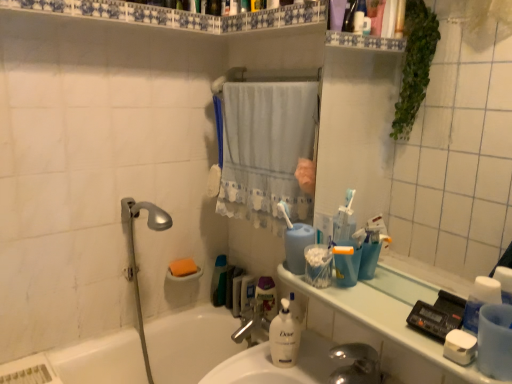
Measure the distance between white glossy bathtub at lower left and camera.

white glossy bathtub at lower left is 4.39 feet away from camera.

Describe the element at coordinates (176, 15) in the screenshot. I see `white glossy shelf at upper center` at that location.

The height and width of the screenshot is (384, 512). What do you see at coordinates (298, 246) in the screenshot?
I see `blue matte cup at center, which ranks as the 2th cleaning product in bottom-to-top order` at bounding box center [298, 246].

Image resolution: width=512 pixels, height=384 pixels. Describe the element at coordinates (426, 147) in the screenshot. I see `transparent plastic mirror at upper right` at that location.

The height and width of the screenshot is (384, 512). What are the coordinates of `white glossy bathtub at lower left` in the screenshot? It's located at (190, 343).

Which of these two, green plastic bottle at center or blue matte cup at center, which ranks as the 2th cleaning product in bottom-to-top order, stands taller?

green plastic bottle at center is taller.

What's the angular difference between green plastic bottle at center and blue matte cup at center, which ranks as the 2th cleaning product in bottom-to-top order,'s facing directions?

They differ by 90.8 degrees in their facing directions.

Is green plastic bottle at center not within blue matte cup at center, marked as the first cleaning product in a top-to-bottom arrangement?

Yes, green plastic bottle at center is located beyond the bounds of blue matte cup at center, marked as the first cleaning product in a top-to-bottom arrangement.

From the image's perspective, which one is positioned lower, green plastic bottle at center or blue matte cup at center, marked as the first cleaning product in a top-to-bottom arrangement?

green plastic bottle at center, from the image's perspective.

You are a GUI agent. You are given a task and a screenshot of the screen. Output one action in this format:
    pyautogui.click(x=<x>, y=<y>)
    Task: Click on the sink that is above the green plastic bottle at center (from a real-world perspective)
    The width and height of the screenshot is (512, 384).
    Given the screenshot: What is the action you would take?
    (x=277, y=366)

Relative to white glossy sink at center, is green plastic bottle at center in front or behind?

green plastic bottle at center is positioned farther from the viewer than white glossy sink at center.

From a real-world perspective, is green plastic bottle at center positioned above or below white glossy sink at center?

green plastic bottle at center is situated lower than white glossy sink at center in the real world.

In the scene shown: Which object is thinner, green plastic bottle at center or white glossy sink at center?

green plastic bottle at center.

Visually, is transparent plastic mirror at upper right positioned to the left or to the right of green plastic bottle at center?

transparent plastic mirror at upper right is to the right of green plastic bottle at center.

Is green plastic bottle at center at the back of transparent plastic mirror at upper right?

No, green plastic bottle at center is not at the back of transparent plastic mirror at upper right.

Considering the sizes of objects transparent plastic mirror at upper right and green plastic bottle at center in the image provided, who is thinner, transparent plastic mirror at upper right or green plastic bottle at center?

transparent plastic mirror at upper right is thinner.

Are transparent plastic mirror at upper right and green plastic bottle at center making contact?

No, transparent plastic mirror at upper right is not next to green plastic bottle at center.

Considering the relative sizes of silver metallic shower head at left and white matte soap at lower right, the 1th soap positioned from the front, in the image provided, is silver metallic shower head at left smaller than white matte soap at lower right, the 1th soap positioned from the front,?

No.

Can we say silver metallic shower head at left lies outside white matte soap at lower right, the 2th soap from the back?

That's correct, silver metallic shower head at left is outside of white matte soap at lower right, the 2th soap from the back.

Between silver metallic shower head at left and white matte soap at lower right, the first soap viewed from the right, which one has less height?

white matte soap at lower right, the first soap viewed from the right.

I want to click on counter top directly beneath the white glossy shelf at upper center (from a real-world perspective), so click(x=382, y=320).

From the image's perspective, is white glossy shelf at upper center on top of white glossy counter top at upper right?

Indeed, from the image's perspective, white glossy shelf at upper center is shown above white glossy counter top at upper right.

Is white glossy shelf at upper center bigger than white glossy counter top at upper right?

Yes, white glossy shelf at upper center is bigger than white glossy counter top at upper right.

Is white glossy shelf at upper center at the left side of white glossy counter top at upper right?

Yes, white glossy shelf at upper center is to the left of white glossy counter top at upper right.

Between white plastic toothbrush at center and blue matte cup at center, which ranks as the 2th cleaning product in bottom-to-top order, which one has larger size?

With larger size is blue matte cup at center, which ranks as the 2th cleaning product in bottom-to-top order.

Considering the points (289, 215) and (301, 229), which point is behind, point (289, 215) or point (301, 229)?

The point (289, 215) is farther from the camera.

Can you see white plastic toothbrush at center touching blue matte cup at center, which ranks as the 2th cleaning product in bottom-to-top order?

No.

In the scene shown: Is white plastic toothbrush at center facing towards blue matte cup at center, marked as the first cleaning product in a top-to-bottom arrangement?

No, white plastic toothbrush at center is not turned towards blue matte cup at center, marked as the first cleaning product in a top-to-bottom arrangement.

Is transparent plastic mirror at upper right facing away from white glossy bathtub at lower left?

No.

Is transparent plastic mirror at upper right inside or outside of white glossy bathtub at lower left?

transparent plastic mirror at upper right is outside white glossy bathtub at lower left.

Can you tell me how much transparent plastic mirror at upper right and white glossy bathtub at lower left differ in facing direction?

The angle between the facing direction of transparent plastic mirror at upper right and the facing direction of white glossy bathtub at lower left is 90.8 degrees.

Is the position of transparent plastic mirror at upper right less distant than that of white glossy bathtub at lower left?

Yes, it is.

Locate an element on the screen. cleaning product that is the 2nd one when counting rightward from the green plastic bottle at center is located at coordinates (298, 246).

What are the coordinates of `sink lying in front of the green plastic bottle at center` in the screenshot? It's located at point(277,366).

Based on their spatial positions, is translucent plastic mouthwash at center or white matte bottle at center, placed as the second cleaning product when sorted from top to bottom, closer to white glossy sink at center?

white matte bottle at center, placed as the second cleaning product when sorted from top to bottom.

When comparing their distances from white glossy sink at center, does white glossy bathtub at lower left or white lace curtain at center seem further?

Among the two, white glossy bathtub at lower left is located further to white glossy sink at center.

Which object lies nearer to the anchor point silver metallic shower head at left, white glossy counter top at upper right or translucent plastic mouthwash at center?

translucent plastic mouthwash at center.

When comparing their distances from white glossy bathtub at lower left, does white lace curtain at center or white plastic toothbrush at center seem closer?

white lace curtain at center is closer to white glossy bathtub at lower left.

Which object lies nearer to the anchor point translucent plastic mouthwash at center, white glossy sink at center or transparent plastic mirror at upper right?

Based on the image, white glossy sink at center appears to be nearer to translucent plastic mouthwash at center.

When comparing their distances from white plastic toothbrush at center, does white glossy shelf at upper center or green plastic bottle at center seem closer?

The object closer to white plastic toothbrush at center is green plastic bottle at center.

Considering their positions, is silver metallic shower head at left positioned closer to white glossy shelf at upper center than white glossy bathtub at lower left?

silver metallic shower head at left lies closer to white glossy shelf at upper center than the other object.

When comparing their distances from orange sponge at lower left, marked as the first soap in a back-to-front arrangement, does silver metallic faucet at sink center or white matte bottle at center, acting as the 1th cleaning product starting from the bottom, seem further?

white matte bottle at center, acting as the 1th cleaning product starting from the bottom, is positioned further to the anchor orange sponge at lower left, marked as the first soap in a back-to-front arrangement.

The image size is (512, 384). Identify the location of shower between white glossy shelf at upper center and green plastic bottle at center from top to bottom. (135, 257).

Find the location of a particular element. The height and width of the screenshot is (384, 512). toothbrush located between white matte soap at lower right, the 2th soap from the left, and orange sponge at lower left, the 2th soap when ordered from front to back, in the depth direction is located at coordinates (284, 213).

What are the coordinates of `mouthwash positioned between white matte bottle at center, placed as the second cleaning product when sorted from top to bottom, and green plastic bottle at center from near to far` in the screenshot? It's located at (267, 296).

Locate an element on the screen. This screenshot has height=384, width=512. counter top between white lace curtain at center and white glossy bathtub at lower left from top to bottom is located at coordinates tap(382, 320).